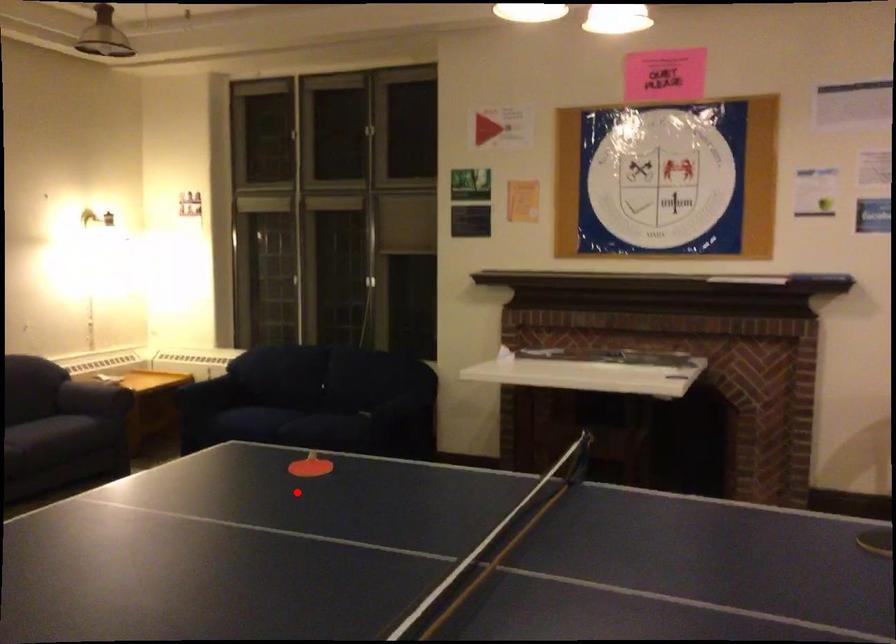
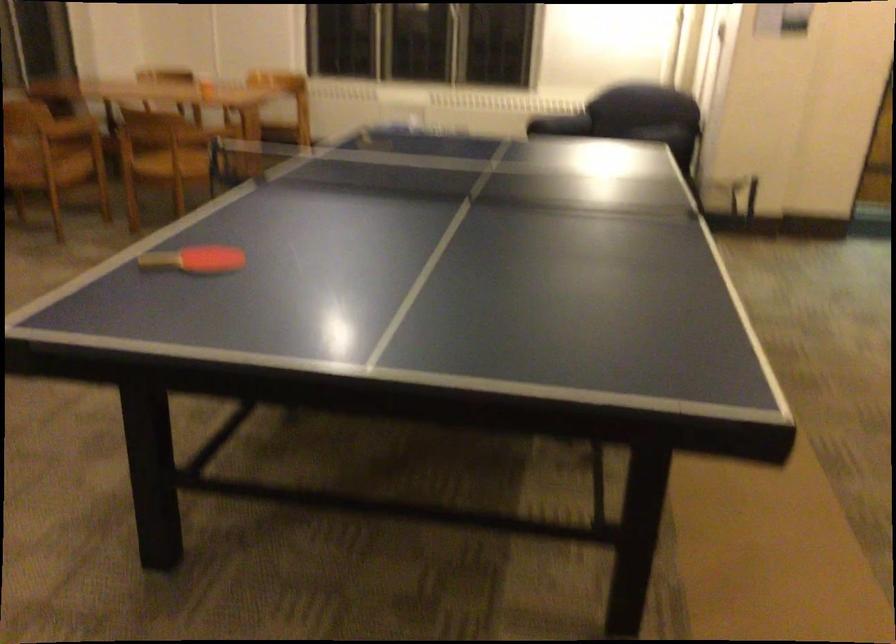
The point at the highlighted location is marked in the first image. Where is the corresponding point in the second image?

(194, 259)